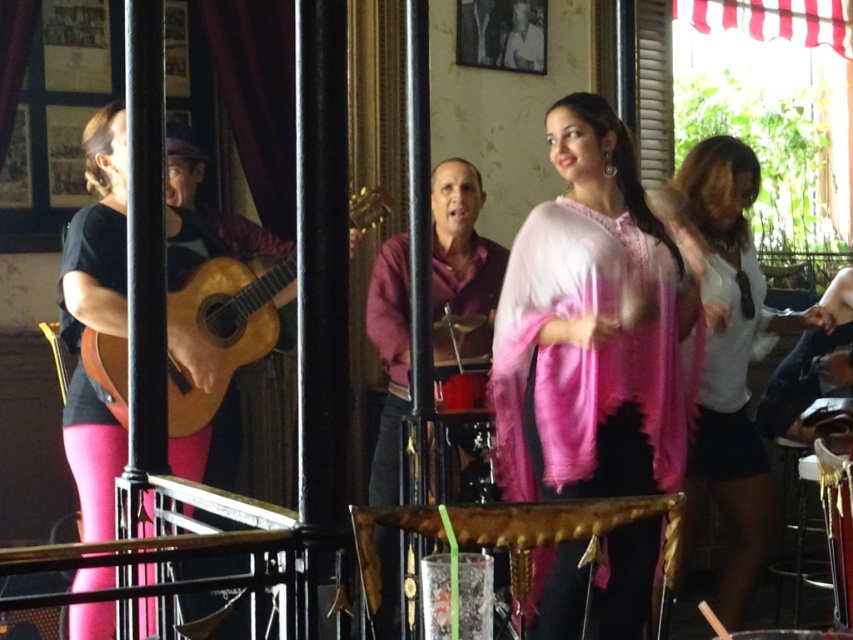
You are a photographer at the event and want to capture a photo of both the pink textured scarf at center and the maroon sweater at center. Which one should you focus on first to ensure it appears in the foreground of your photo?

The pink textured scarf at center is above the maroon sweater at center, so focusing on the pink textured scarf at center first will place it in the foreground.

You are a photographer trying to capture both the pink textured scarf at center and the maroon sweater at center in a single frame. Based on the scene, can you fit both objects into your camera view without moving your position? Please explain your reasoning.

The pink textured scarf at center and the maroon sweater at center are 26.34 inches apart. Since the distance between them is fixed and they are both positioned at the center of the scene, it should be possible to include both in the camera frame without moving, provided the camera has a wide enough lens to accommodate the 26.34 inch span between them.

You are a photographer at the event and want to capture a photo that includes both the pink textured scarf at center and the white matte shirt at right. Based on their positions, where should you position your camera to ensure both are visible in the frame?

Position your camera at a lower angle so that the pink textured scarf at center, which is above the white matte shirt at right, can be captured along with the shirt in the lower part of the frame.